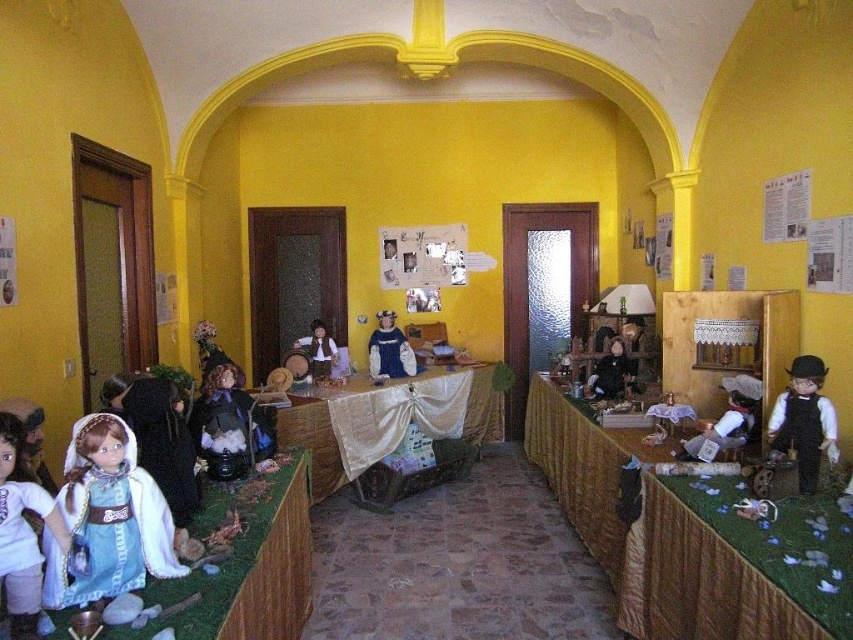
Is matte black doll at lower right thinner than wooden doll at center?

No, matte black doll at lower right is not thinner than wooden doll at center.

Where is `matte black doll at lower right`? matte black doll at lower right is located at coordinates (728, 419).

Locate an element on the screen. The image size is (853, 640). matte black doll at lower right is located at coordinates (728, 419).

Can you confirm if white lace cloth at center is positioned below matte blue dress at center?

Yes, white lace cloth at center is below matte blue dress at center.

Is point (374, 396) farther from camera compared to point (378, 362)?

No, it is not.

Between point (347, 380) and point (381, 317), which one is positioned in front?

Point (347, 380) is in front.

Find the location of `white lace cloth at center`. white lace cloth at center is located at coordinates (386, 419).

Identify the location of matte black doll at lower right. Image resolution: width=853 pixels, height=640 pixels. (728, 419).

Does point (758, 419) come farther from viewer compared to point (601, 381)?

No, it is not.

Where is `matte black doll at lower right`? The width and height of the screenshot is (853, 640). matte black doll at lower right is located at coordinates (728, 419).